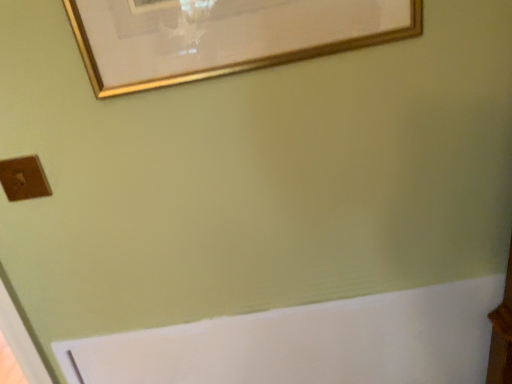
Identify the location of gold metallic picture frame at upper center. (223, 36).

What do you see at coordinates (223, 36) in the screenshot?
I see `gold metallic picture frame at upper center` at bounding box center [223, 36].

What do you see at coordinates (24, 178) in the screenshot? The height and width of the screenshot is (384, 512). I see `brown matte/light switch at lower left` at bounding box center [24, 178].

Locate an element on the screen. Image resolution: width=512 pixels, height=384 pixels. brown matte/light switch at lower left is located at coordinates (24, 178).

Find the location of a particular element. gold metallic picture frame at upper center is located at coordinates (223, 36).

From the picture: Which object is positioned more to the left, gold metallic picture frame at upper center or brown matte/light switch at lower left?

brown matte/light switch at lower left.

Does gold metallic picture frame at upper center lie in front of brown matte/light switch at lower left?

Yes.

Considering the points (149, 53) and (19, 181), which point is in front, point (149, 53) or point (19, 181)?

The point (149, 53) is more forward.

From the image's perspective, is gold metallic picture frame at upper center on top of brown matte/light switch at lower left?

Indeed, from the image's perspective, gold metallic picture frame at upper center is shown above brown matte/light switch at lower left.

From a real-world perspective, relative to brown matte/light switch at lower left, is gold metallic picture frame at upper center vertically above or below?

In terms of real-world spatial position, gold metallic picture frame at upper center is above brown matte/light switch at lower left.

Is gold metallic picture frame at upper center wider than brown matte/light switch at lower left?

Yes, gold metallic picture frame at upper center is wider than brown matte/light switch at lower left.

In terms of height, does gold metallic picture frame at upper center look taller or shorter compared to brown matte/light switch at lower left?

Clearly, gold metallic picture frame at upper center is taller compared to brown matte/light switch at lower left.

Considering the sizes of objects gold metallic picture frame at upper center and brown matte/light switch at lower left in the image provided, who is smaller, gold metallic picture frame at upper center or brown matte/light switch at lower left?

With smaller size is brown matte/light switch at lower left.

Is gold metallic picture frame at upper center outside of brown matte/light switch at lower left?

That's correct, gold metallic picture frame at upper center is outside of brown matte/light switch at lower left.

Is gold metallic picture frame at upper center not near brown matte/light switch at lower left?

That's not correct — gold metallic picture frame at upper center is a little close to brown matte/light switch at lower left.

Is gold metallic picture frame at upper center turned away from brown matte/light switch at lower left?

No, gold metallic picture frame at upper center's orientation is not away from brown matte/light switch at lower left.

In the scene shown: What's the angular difference between gold metallic picture frame at upper center and brown matte/light switch at lower left's facing directions?

There is a 0.186-degree angle between the facing directions of gold metallic picture frame at upper center and brown matte/light switch at lower left.

Locate an element on the screen. The width and height of the screenshot is (512, 384). picture frame lying in front of the brown matte/light switch at lower left is located at coordinates (223, 36).

Can you confirm if brown matte/light switch at lower left is positioned to the left of gold metallic picture frame at upper center?

Correct, you'll find brown matte/light switch at lower left to the left of gold metallic picture frame at upper center.

Is the position of brown matte/light switch at lower left more distant than that of gold metallic picture frame at upper center?

Yes, brown matte/light switch at lower left is behind gold metallic picture frame at upper center.

Which point is more forward, [23,175] or [160,8]?

The point [160,8] is closer.

From the image's perspective, which one is positioned higher, brown matte/light switch at lower left or gold metallic picture frame at upper center?

From the image's view, gold metallic picture frame at upper center is above.

Consider the image. From a real-world perspective, relative to gold metallic picture frame at upper center, is brown matte/light switch at lower left vertically above or below?

From a real-world perspective, brown matte/light switch at lower left is physically below gold metallic picture frame at upper center.

Considering the sizes of objects brown matte/light switch at lower left and gold metallic picture frame at upper center in the image provided, who is wider, brown matte/light switch at lower left or gold metallic picture frame at upper center?

Wider between the two is gold metallic picture frame at upper center.

Can you confirm if brown matte/light switch at lower left is shorter than gold metallic picture frame at upper center?

Yes.

Is brown matte/light switch at lower left smaller than gold metallic picture frame at upper center?

Correct, brown matte/light switch at lower left occupies less space than gold metallic picture frame at upper center.

Would you say brown matte/light switch at lower left is inside or outside gold metallic picture frame at upper center?

brown matte/light switch at lower left is not enclosed by gold metallic picture frame at upper center.

Is brown matte/light switch at lower left touching gold metallic picture frame at upper center?

No.

Could you tell me if brown matte/light switch at lower left is turned towards gold metallic picture frame at upper center?

No.

What's the angular difference between brown matte/light switch at lower left and gold metallic picture frame at upper center's facing directions?

The angular difference between brown matte/light switch at lower left and gold metallic picture frame at upper center is 0.186 degrees.

The image size is (512, 384). In order to click on light switch below the gold metallic picture frame at upper center (from a real-world perspective) in this screenshot , I will do pos(24,178).

The image size is (512, 384). In order to click on light switch that is under the gold metallic picture frame at upper center (from a real-world perspective) in this screenshot , I will do `click(24, 178)`.

Identify the location of picture frame on the right of brown matte/light switch at lower left. (223, 36).